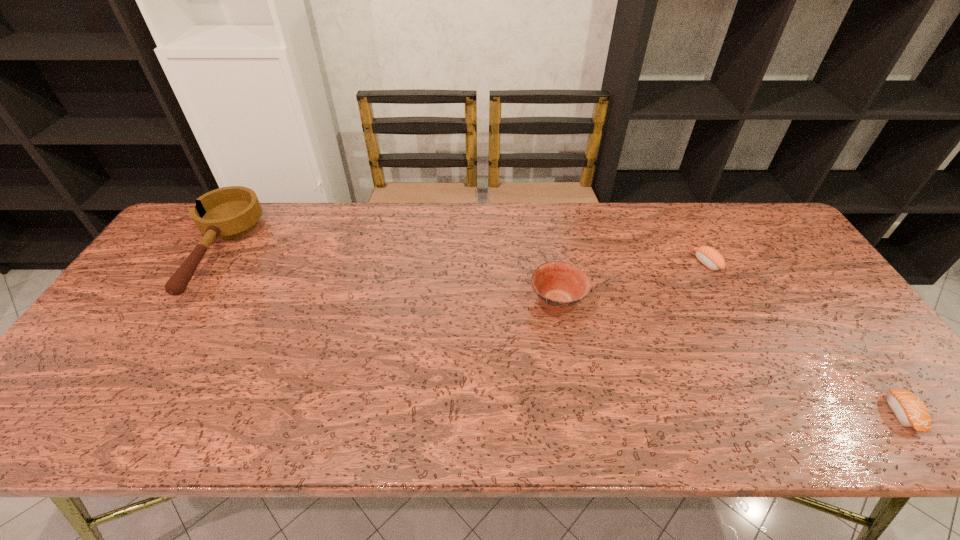
I want to click on saucepan, so click(230, 212).

Find the location of a particular element. bowl is located at coordinates (560, 285).

Find the location of a particular element. The width and height of the screenshot is (960, 540). the third tallest object is located at coordinates (708, 256).

Locate an element on the screen. The width and height of the screenshot is (960, 540). the third object from left to right is located at coordinates (708, 256).

Find the location of a particular element. This screenshot has height=540, width=960. the shorter sushi is located at coordinates (909, 409).

Find the location of a particular element. This screenshot has width=960, height=540. the nearer sushi is located at coordinates (909, 409).

You are a GUI agent. You are given a task and a screenshot of the screen. Output one action in this format:
    pyautogui.click(x=<x>, y=<y>)
    Task: Click on the free region located 0.310m with the handle on the side of the saucepan
    
    Given the screenshot: What is the action you would take?
    pyautogui.click(x=116, y=416)

Image resolution: width=960 pixels, height=540 pixels. In order to click on free spot located 0.230m on the back of the third object from right to left in this screenshot , I will do `click(545, 231)`.

Find the location of `vacant space positioned 0.230m on the right of the taller sushi`. vacant space positioned 0.230m on the right of the taller sushi is located at coordinates (795, 263).

At what (x,y) coordinates should I click in order to perform the action: click on vacant space located on the left of the shortest object. Please return your answer as a coordinate pair (x, y). Looking at the image, I should click on (729, 413).